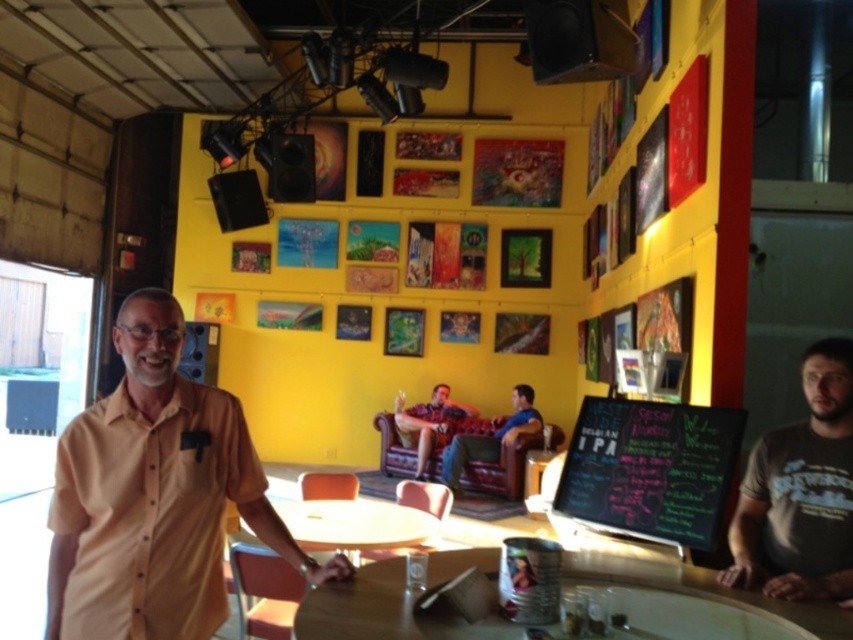
Can you confirm if matte yellow shirt at center is wider than yellow matte table at center?

Incorrect, matte yellow shirt at center's width does not surpass yellow matte table at center's.

Who is more forward, (207, 438) or (283, 515)?

Point (207, 438) is more forward.

Is point (317, 577) closer to viewer compared to point (383, 532)?

Yes.

Where is `matte yellow shirt at center`? This screenshot has width=853, height=640. matte yellow shirt at center is located at coordinates (155, 496).

Can you confirm if wooden round table at center is positioned to the right of chalkboard at center?

Incorrect, wooden round table at center is not on the right side of chalkboard at center.

Is wooden round table at center above chalkboard at center?

No.

Who is more distant from viewer, [749,628] or [711,531]?

The point [711,531] is behind.

Locate an element on the screen. This screenshot has height=640, width=853. wooden round table at center is located at coordinates (708, 598).

Is chalkboard at center below patterned fabric shirt at center?

No.

Does chalkboard at center come in front of patterned fabric shirt at center?

Yes, chalkboard at center is in front of patterned fabric shirt at center.

Who is more forward, (x=703, y=484) or (x=444, y=413)?

Point (x=703, y=484)

Identify the location of chalkboard at center. (651, 468).